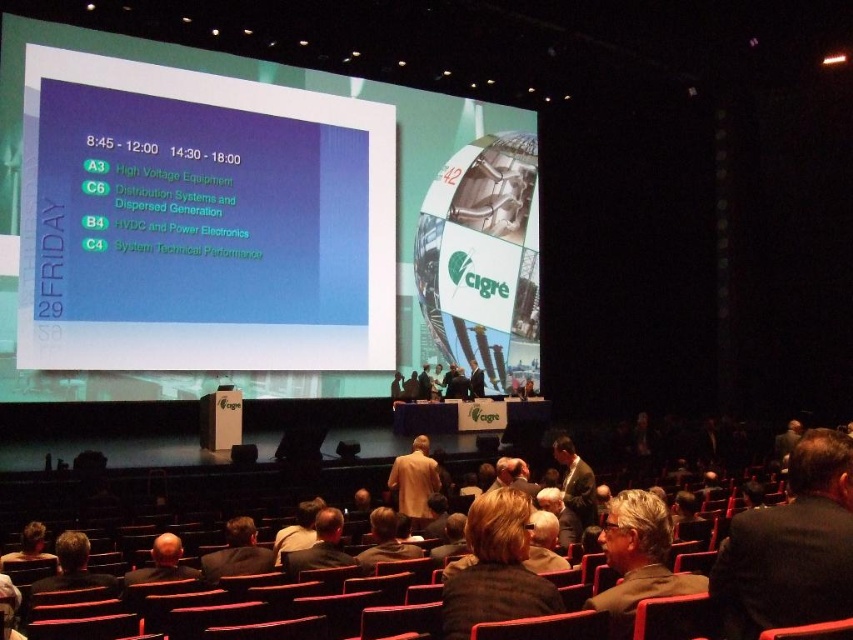
Between dark brown hair at lower center and dark brown hair at lower left, which one appears on the left side from the viewer's perspective?

From the viewer's perspective, dark brown hair at lower left appears more on the left side.

Does dark brown hair at lower center have a lesser height compared to dark brown hair at lower left?

No.

Does point (132, 572) come in front of point (45, 554)?

That is True.

Locate an element on the screen. The height and width of the screenshot is (640, 853). dark brown hair at lower center is located at coordinates (161, 563).

Consider the image. Can you confirm if dark suit at center is taller than light brown suit at lower right?

Yes, dark suit at center is taller than light brown suit at lower right.

Between dark suit at center and light brown suit at lower right, which one is positioned higher?

light brown suit at lower right is above.

Who is more distant from viewer, (842, 596) or (650, 516)?

The point (650, 516) is more distant.

This screenshot has height=640, width=853. I want to click on dark suit at center, so click(791, 547).

Who is positioned more to the left, light brown suit at lower right or dark brown hair at lower left?

dark brown hair at lower left

Describe the element at coordinates (637, 557) in the screenshot. I see `light brown suit at lower right` at that location.

Where is `light brown suit at lower right`? Image resolution: width=853 pixels, height=640 pixels. light brown suit at lower right is located at coordinates (637, 557).